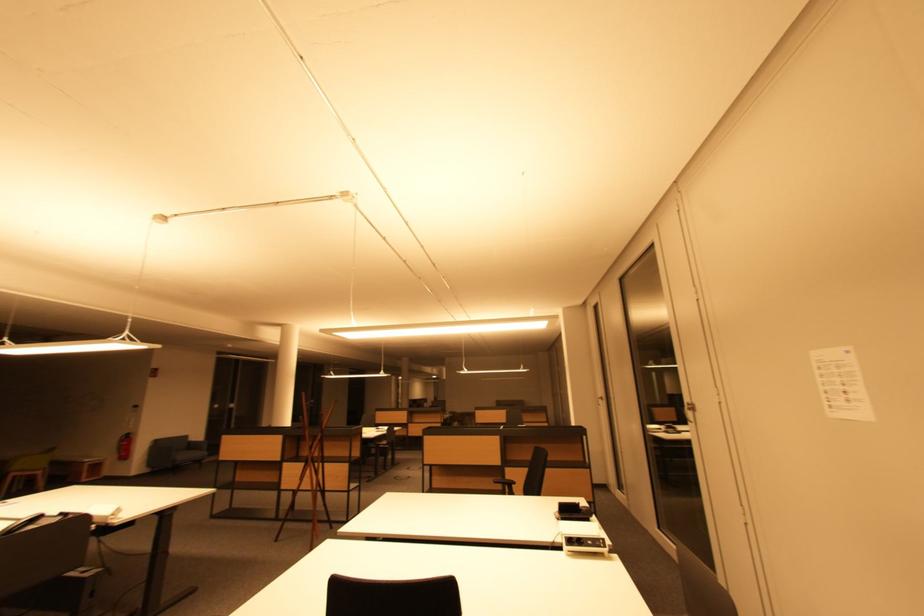
Describe the element at coordinates (608, 408) in the screenshot. I see `a silver door handle` at that location.